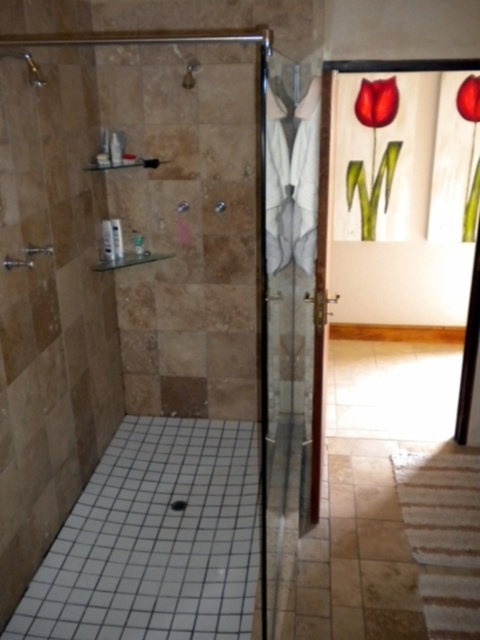
Image resolution: width=480 pixels, height=640 pixels. I want to click on matte wooden tulip at upper right, so click(373, 150).

What do you see at coordinates (373, 150) in the screenshot?
I see `matte wooden tulip at upper right` at bounding box center [373, 150].

Between point (383, 81) and point (200, 64), which one is positioned behind?

The point (383, 81) is behind.

Locate an element on the screen. matte wooden tulip at upper right is located at coordinates (373, 150).

Is red glass tulip at upper right further to the viewer compared to brushed metal showerhead at upper left?

Yes, red glass tulip at upper right is further from the viewer.

Can you confirm if red glass tulip at upper right is positioned above brushed metal showerhead at upper left?

Yes, red glass tulip at upper right is above brushed metal showerhead at upper left.

Does point (472, 214) come closer to viewer compared to point (41, 76)?

No, it is not.

Locate an element on the screen. Image resolution: width=480 pixels, height=640 pixels. red glass tulip at upper right is located at coordinates click(x=470, y=150).

Does red glass tulip at upper right appear on the right side of matte silver faucet at upper center?

Yes, red glass tulip at upper right is to the right of matte silver faucet at upper center.

Which is above, red glass tulip at upper right or matte silver faucet at upper center?

matte silver faucet at upper center is above.

You are a GUI agent. You are given a task and a screenshot of the screen. Output one action in this format:
    pyautogui.click(x=<x>, y=<y>)
    Task: Click on the red glass tulip at upper right
    Image resolution: width=480 pixels, height=640 pixels.
    Given the screenshot: What is the action you would take?
    pyautogui.click(x=470, y=150)

This screenshot has height=640, width=480. Identify the location of red glass tulip at upper right. (470, 150).